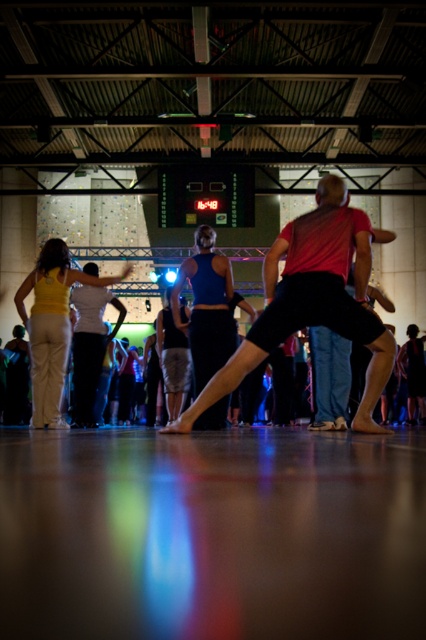
Who is more distant from viewer, (250, 333) or (57, 396)?

The point (57, 396) is more distant.

Which is more to the right, matte black shorts at center or matte yellow tank top at center?

matte black shorts at center is more to the right.

Between point (319, 214) and point (43, 260), which one is positioned in front?

Point (319, 214) is in front.

Identify the location of matte black shorts at center. This screenshot has width=426, height=640. (x=311, y=300).

Can you confirm if matte black shorts at center is wider than blue fabric skirt at center?

Yes.

Is the position of matte black shorts at center less distant than that of blue fabric skirt at center?

Yes, matte black shorts at center is in front of blue fabric skirt at center.

Is point (351, 236) in front of point (178, 317)?

That is True.

Identify the location of matte black shorts at center. (311, 300).

The height and width of the screenshot is (640, 426). I want to click on matte yellow tank top at center, so click(x=51, y=326).

Is the position of matte yellow tank top at center less distant than that of blue fabric skirt at center?

That is False.

Does point (39, 314) lie behind point (184, 273)?

That is True.

Find the location of a particular element. This screenshot has width=426, height=640. matte yellow tank top at center is located at coordinates (51, 326).